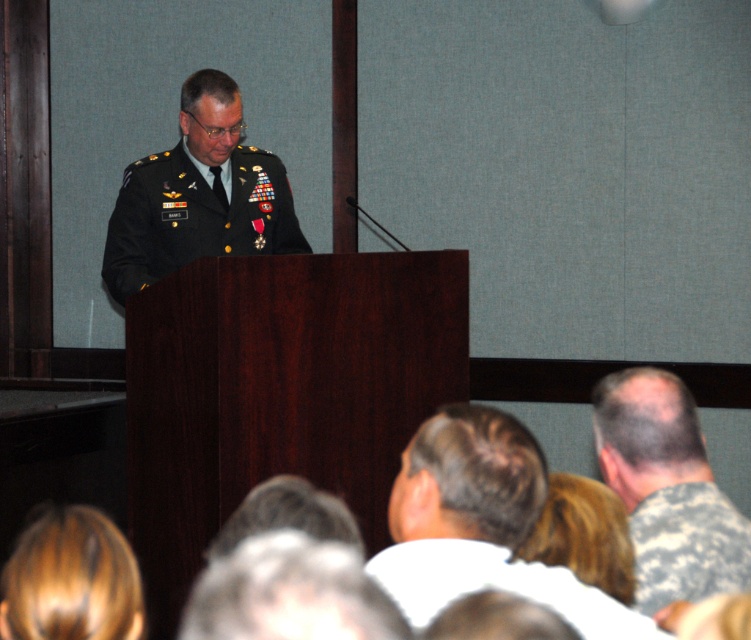
Consider the image. Is blonde hair at lower left to the left of camouflage fabric uniform at lower center from the viewer's perspective?

Yes, blonde hair at lower left is to the left of camouflage fabric uniform at lower center.

Does blonde hair at lower left have a lesser height compared to camouflage fabric uniform at lower center?

Yes.

Does point (101, 554) lie behind point (474, 572)?

No.

At what (x,y) coordinates should I click in order to perform the action: click on blonde hair at lower left. Please return your answer as a coordinate pair (x, y). Image resolution: width=751 pixels, height=640 pixels. Looking at the image, I should click on coord(71,579).

Is point (270, 182) positioned behind point (599, 602)?

Yes, it is.

Is point (234, 102) in front of point (566, 570)?

That is False.

Which is in front, point (128, 176) or point (427, 580)?

Point (427, 580)

Find the location of a particular element. green military uniform at center is located at coordinates (198, 195).

Is the position of brown hair at lower center more distant than that of camouflage uniform at lower right?

No, brown hair at lower center is closer to the viewer.

Consider the image. Which is more to the right, brown hair at lower center or camouflage uniform at lower right?

Positioned to the right is camouflage uniform at lower right.

Does point (489, 452) come farther from viewer compared to point (707, 500)?

No, it is not.

Where is `brown hair at lower center`? This screenshot has height=640, width=751. brown hair at lower center is located at coordinates (481, 525).